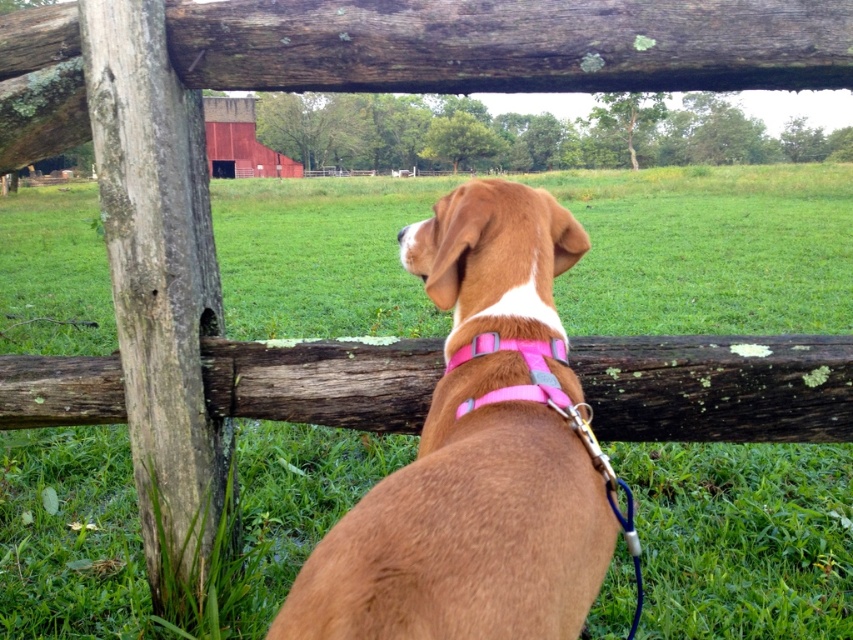
Which is more to the left, brown matte dog at center or pink fabric neckband at center?

From the viewer's perspective, brown matte dog at center appears more on the left side.

Which of these two, brown matte dog at center or pink fabric neckband at center, stands shorter?

pink fabric neckband at center

Describe the element at coordinates (474, 456) in the screenshot. I see `brown matte dog at center` at that location.

Find the location of a particular element. The image size is (853, 640). brown matte dog at center is located at coordinates (474, 456).

Is weathered wood log at center shorter than pink fabric neckband at center?

No.

Who is lower down, weathered wood log at center or pink fabric neckband at center?

weathered wood log at center is below.

You are a GUI agent. You are given a task and a screenshot of the screen. Output one action in this format:
    pyautogui.click(x=<x>, y=<y>)
    Task: Click on the weathered wood log at center
    
    Given the screenshot: What is the action you would take?
    pyautogui.click(x=717, y=387)

Can you confirm if brown matte dog at center is smaller than weathered wood log at center?

Actually, brown matte dog at center might be larger than weathered wood log at center.

Is point (534, 326) farther from viewer compared to point (788, 368)?

No, (534, 326) is in front of (788, 368).

Which is behind, point (524, 406) or point (74, 374)?

Point (74, 374)

I want to click on brown matte dog at center, so click(474, 456).